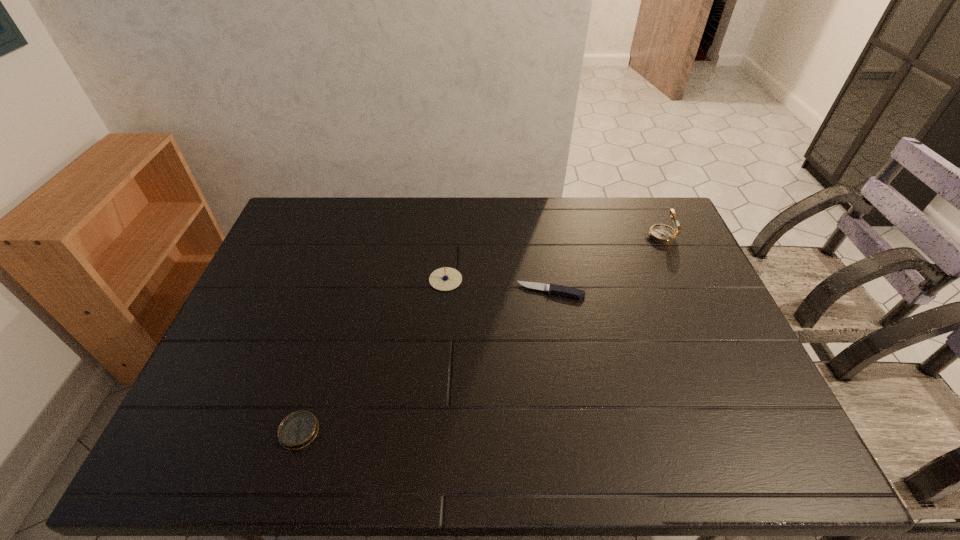
Where is `vacant point at the far right corner`? vacant point at the far right corner is located at coordinates (666, 214).

Locate an element on the screen. free space at the near right corner of the desktop is located at coordinates (762, 437).

Identify the location of unoccupied area between the third shortest object and the leftmost compass. The height and width of the screenshot is (540, 960). (372, 355).

Where is `free space that is in between the shortest compass and the steak knife`? free space that is in between the shortest compass and the steak knife is located at coordinates (425, 361).

This screenshot has height=540, width=960. In order to click on vacant area between the second tallest object and the nearest compass in this screenshot , I will do `click(372, 355)`.

At what (x,y) coordinates should I click in order to perform the action: click on blank region between the rightmost compass and the nearest compass. Please return your answer as a coordinate pair (x, y). This screenshot has width=960, height=540. Looking at the image, I should click on (479, 334).

Locate an element on the screen. The width and height of the screenshot is (960, 540). free area in between the leftmost compass and the rightmost compass is located at coordinates (479, 334).

Locate an element on the screen. The height and width of the screenshot is (540, 960). free spot between the rightmost compass and the leftmost object is located at coordinates (479, 334).

At what (x,y) coordinates should I click in order to perform the action: click on free space between the leftmost compass and the farthest compass. Please return your answer as a coordinate pair (x, y). The image size is (960, 540). Looking at the image, I should click on (479, 334).

Identify the location of free space between the leftmost compass and the farthest compass. (479, 334).